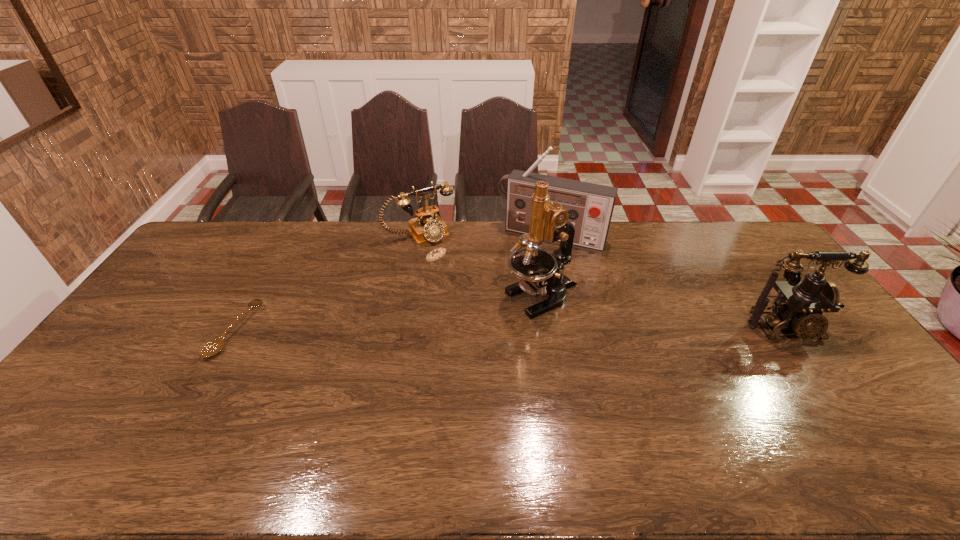
This screenshot has width=960, height=540. I want to click on telephone that is at the far edge, so click(428, 227).

The height and width of the screenshot is (540, 960). In order to click on object that is positioned at the right edge in this screenshot , I will do `click(800, 303)`.

This screenshot has height=540, width=960. Identify the location of vacant space at the far edge of the desktop. (681, 245).

In the image, there is a desktop. Where is `vacant space at the left edge`? This screenshot has height=540, width=960. vacant space at the left edge is located at coordinates (127, 375).

You are a GUI agent. You are given a task and a screenshot of the screen. Output one action in this format:
    pyautogui.click(x=<x>, y=<y>)
    Task: Click on the free spot at the far left corner of the desktop
    The width and height of the screenshot is (960, 540).
    Given the screenshot: What is the action you would take?
    pyautogui.click(x=226, y=224)

You are a GUI agent. You are given a task and a screenshot of the screen. Output one action in this format:
    pyautogui.click(x=<x>, y=<y>)
    Task: Click on the vacant space at the near left corner of the desktop
    The width and height of the screenshot is (960, 540).
    Given the screenshot: What is the action you would take?
    pyautogui.click(x=71, y=407)

The height and width of the screenshot is (540, 960). I want to click on free space that is in between the second tallest object and the fourth object from right to left, so click(485, 234).

At what (x,y) coordinates should I click in order to perform the action: click on blank region between the shortest object and the second shortest object. Please return your answer as a coordinate pair (x, y). Looking at the image, I should click on (327, 282).

Where is `vacant area that lies between the third tallest object and the leftmost object`? vacant area that lies between the third tallest object and the leftmost object is located at coordinates (510, 329).

Identify the location of vacant area between the rightmost object and the shorter telephone. The width and height of the screenshot is (960, 540). (602, 281).